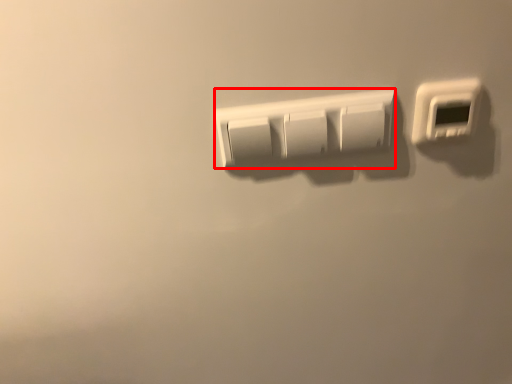
Question: Observing the image, what is the correct spatial positioning of light switch (annotated by the red box) in reference to light switch?

Choices:
 (A) right
 (B) left

Answer: (B)